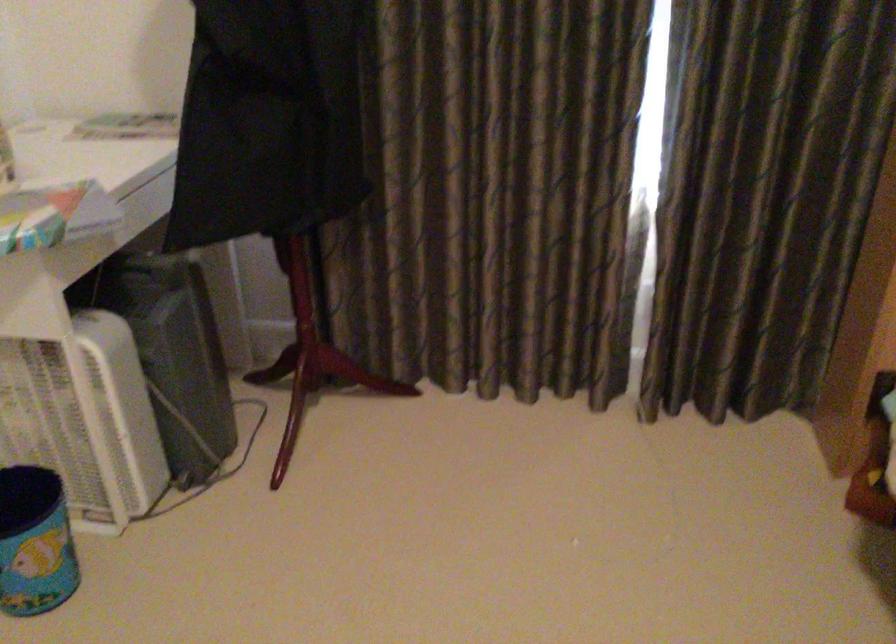
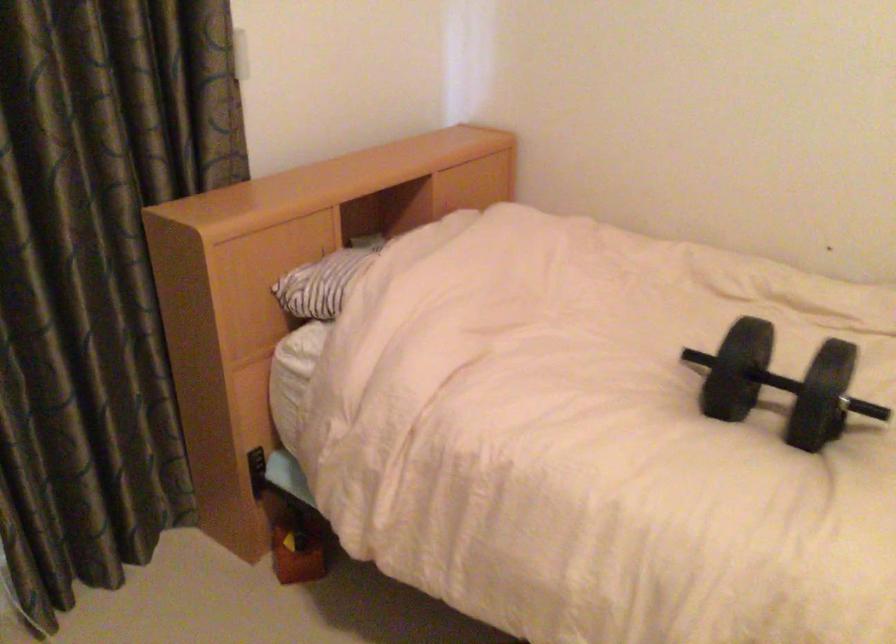
Question: The camera is either moving clockwise (left) or counter-clockwise (right) around the object. The first image is from the beginning of the video and the second image is from the end. Is the camera moving left or right when shooting the video?

Choices:
 (A) Left
 (B) Right

Answer: (A)